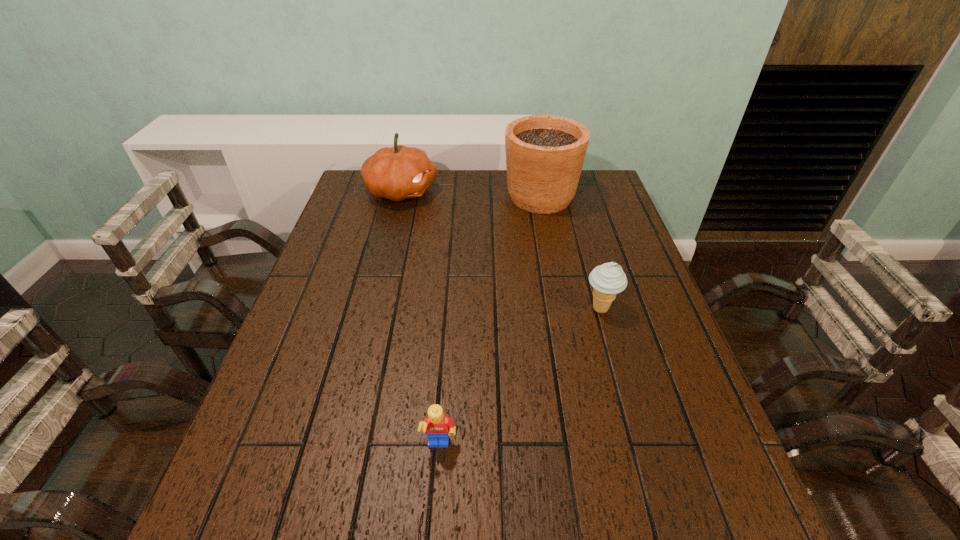
Locate an element on the screen. Image resolution: width=960 pixels, height=540 pixels. vacant area situated 0.100m on the face of the Lego is located at coordinates (435, 515).

Where is `flowerpot that is positioned at the far edge`? flowerpot that is positioned at the far edge is located at coordinates (545, 154).

This screenshot has width=960, height=540. Find the location of `pumpkin at the far edge`. pumpkin at the far edge is located at coordinates (397, 173).

Where is `object that is positioned at the left edge`? This screenshot has height=540, width=960. object that is positioned at the left edge is located at coordinates (397, 173).

Where is `flowerpot that is positioned at the right edge`? flowerpot that is positioned at the right edge is located at coordinates (545, 154).

Locate an element on the screen. icecream located in the right edge section of the desktop is located at coordinates (608, 279).

At what (x,y) coordinates should I click in order to perform the action: click on object that is at the far left corner. Please return your answer as a coordinate pair (x, y). The height and width of the screenshot is (540, 960). Looking at the image, I should click on (397, 173).

Where is `object located in the far right corner section of the desktop`? object located in the far right corner section of the desktop is located at coordinates (545, 154).

The width and height of the screenshot is (960, 540). In the image, there is a desktop. Find the location of `free space at the far edge`. free space at the far edge is located at coordinates (401, 205).

In the image, there is a desktop. Where is `vacant space at the near edge`? The image size is (960, 540). vacant space at the near edge is located at coordinates (355, 516).